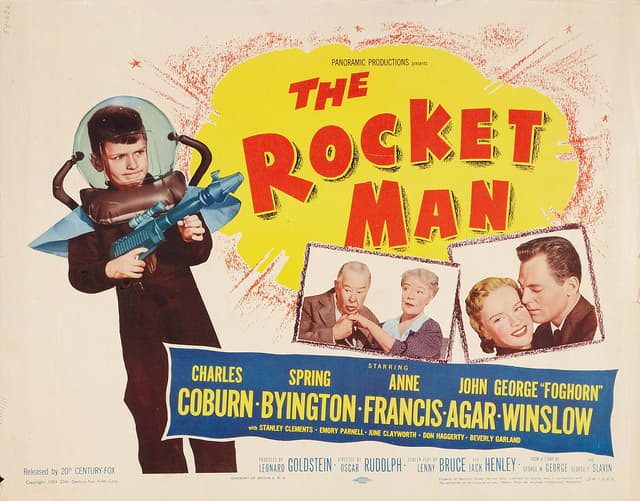
This screenshot has width=640, height=501. Find the location of `glass`. glass is located at coordinates (159, 154).